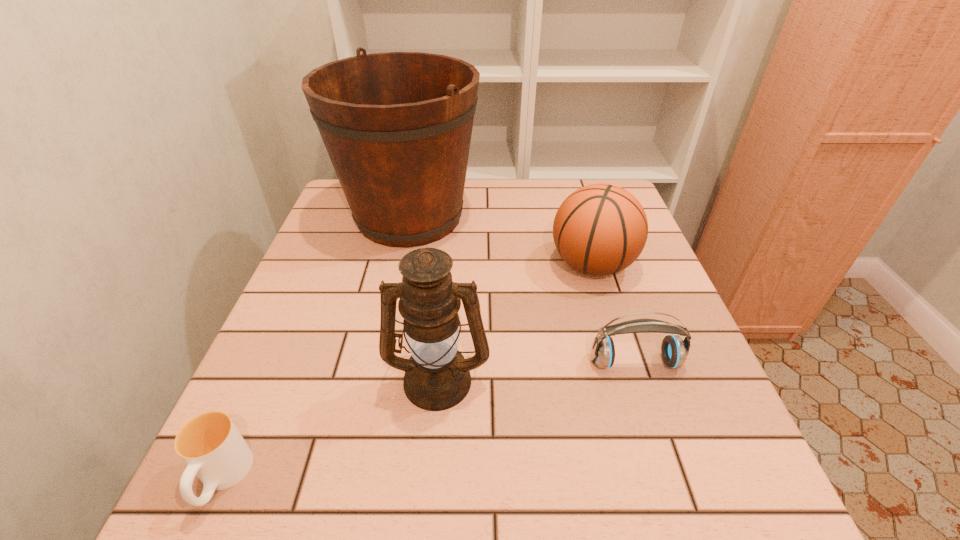
In order to click on object that is positioned at the far edge in this screenshot , I will do `click(397, 126)`.

At what (x,y) coordinates should I click in order to perform the action: click on object that is at the near edge. Please return your answer as a coordinate pair (x, y). Looking at the image, I should click on (210, 444).

Locate an element on the screen. Image resolution: width=960 pixels, height=540 pixels. bucket positioned at the left edge is located at coordinates (397, 126).

Locate an element on the screen. The image size is (960, 540). cup that is at the left edge is located at coordinates (210, 444).

Locate an element on the screen. The width and height of the screenshot is (960, 540). basketball that is at the right edge is located at coordinates (600, 229).

In order to click on headset that is at the right edge in this screenshot , I will do `click(674, 350)`.

What are the coordinates of `object located at the far left corner` in the screenshot? It's located at (397, 126).

Where is `object at the near left corner`? This screenshot has height=540, width=960. object at the near left corner is located at coordinates (210, 444).

Image resolution: width=960 pixels, height=540 pixels. Find the location of `vacant area at the far edge`. vacant area at the far edge is located at coordinates (510, 183).

This screenshot has width=960, height=540. I want to click on free space at the near edge of the desktop, so click(553, 528).